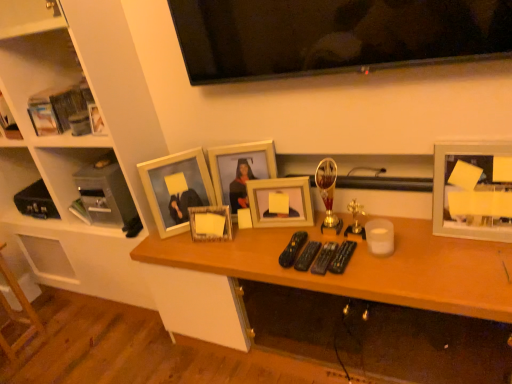
The height and width of the screenshot is (384, 512). In order to click on free space in front of matte wooden picture frame at center, the 3th picture frame when ordered from right to left in this screenshot , I will do `click(254, 241)`.